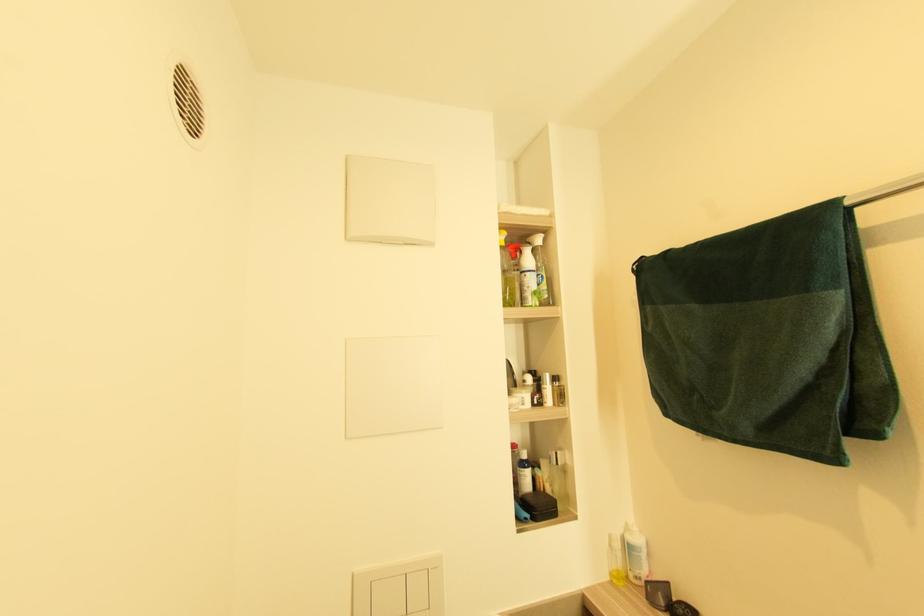
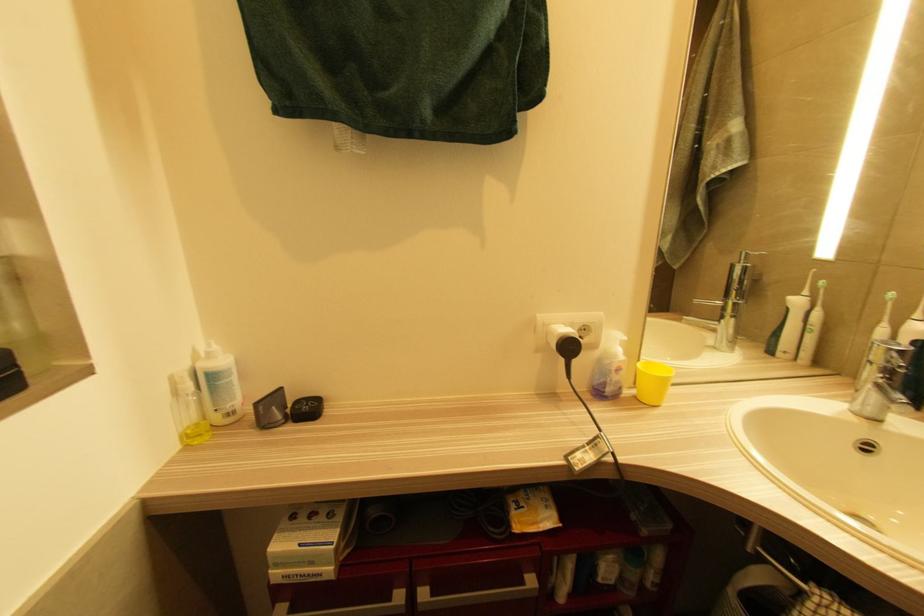
Question: Based on the continuous images, in which direction is the camera rotating? Reply with the corresponding letter.

Choices:
 (A) Left
 (B) Right
 (C) Up
 (D) Down

Answer: (B)